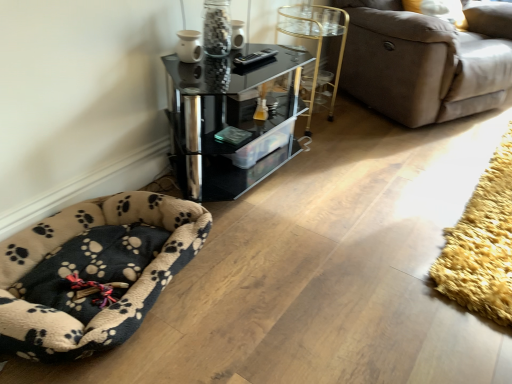
The image size is (512, 384). I want to click on vacant space in front of black glass table at upper center, so click(282, 259).